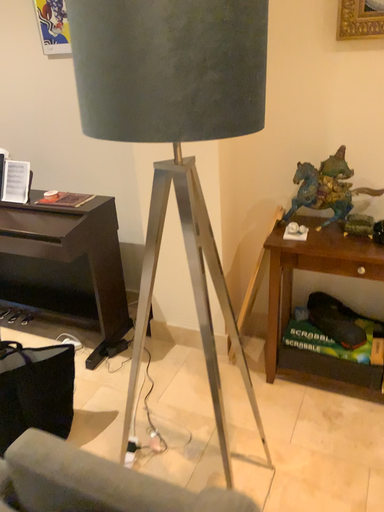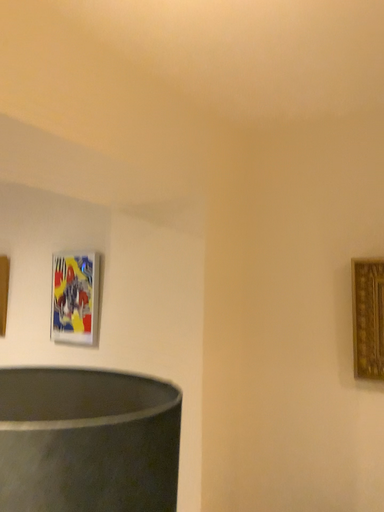
Question: Which way did the camera rotate in the video?

Choices:
 (A) rotated upward
 (B) rotated downward

Answer: (A)